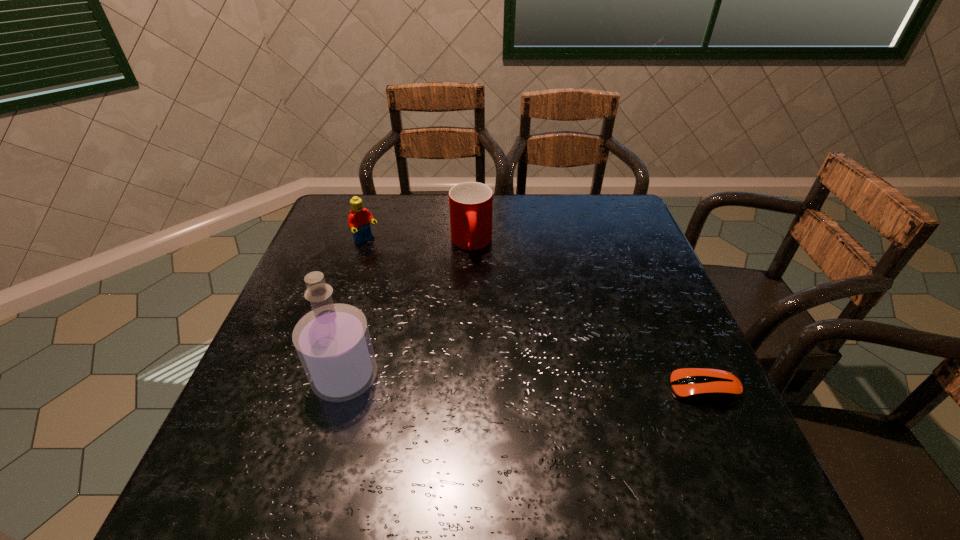
Image resolution: width=960 pixels, height=540 pixels. What are the coordinates of `free space located 0.280m on the face of the Lego` in the screenshot? It's located at 434,299.

Where is `vacant space located 0.370m on the face of the Lego`? The width and height of the screenshot is (960, 540). vacant space located 0.370m on the face of the Lego is located at coordinates (457, 318).

Identify the location of free point located 0.310m on the face of the Lego. (442, 305).

Locate an element on the screen. Image resolution: width=960 pixels, height=540 pixels. cup present at the far edge is located at coordinates (470, 203).

Identify the location of Lego situated at the far edge. This screenshot has height=540, width=960. (359, 219).

Where is `perfume present at the near edge`? Image resolution: width=960 pixels, height=540 pixels. perfume present at the near edge is located at coordinates point(333,342).

At what (x,y) coordinates should I click in order to perform the action: click on computer mouse positioned at the near edge. Please return your answer as a coordinate pair (x, y). Looking at the image, I should click on (705, 385).

The width and height of the screenshot is (960, 540). I want to click on perfume that is positioned at the left edge, so click(333, 342).

At what (x,y) coordinates should I click in order to perform the action: click on Lego positioned at the left edge. Please return your answer as a coordinate pair (x, y). Image resolution: width=960 pixels, height=540 pixels. Looking at the image, I should click on (359, 219).

Locate an element on the screen. The width and height of the screenshot is (960, 540). object that is positioned at the right edge is located at coordinates coord(705,385).